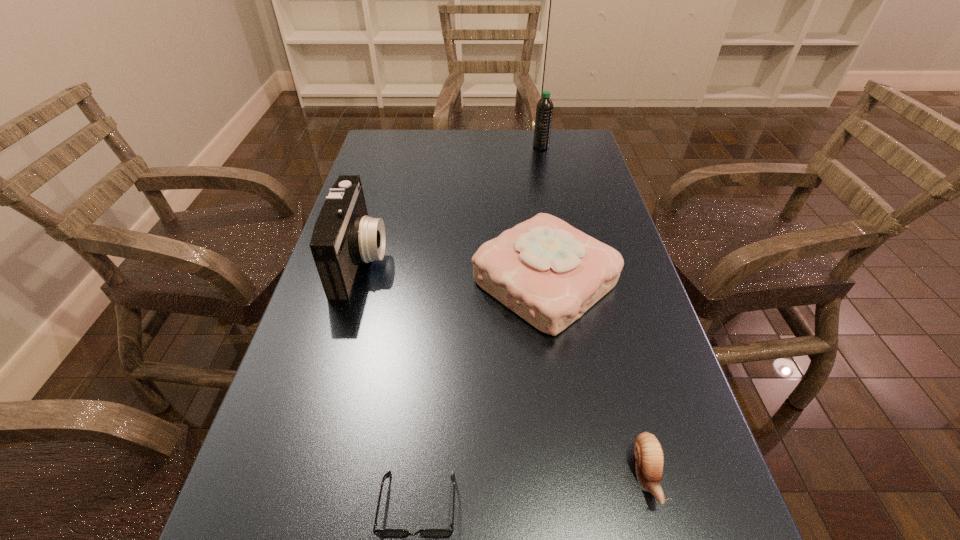
Locate an element on the screen. The height and width of the screenshot is (540, 960). the farthest object is located at coordinates (544, 110).

This screenshot has width=960, height=540. I want to click on camcorder, so click(343, 236).

Image resolution: width=960 pixels, height=540 pixels. I want to click on the third shortest object, so click(549, 273).

The width and height of the screenshot is (960, 540). Identify the location of the fourth tallest object. (649, 459).

This screenshot has width=960, height=540. What are the coordinates of `vacant space located on the left of the farthest object` in the screenshot? It's located at (494, 147).

I want to click on free point located on the lens of the camcorder, so click(410, 260).

Identify the location of vacant space located 0.050m on the right of the third shortest object. This screenshot has width=960, height=540. pyautogui.click(x=639, y=282).

You are a GUI agent. You are given a task and a screenshot of the screen. Output one action in this format:
    pyautogui.click(x=<x>, y=<y>)
    Task: Click on the object that is at the far edge
    The image size is (960, 540).
    Given the screenshot: What is the action you would take?
    pyautogui.click(x=544, y=110)

This screenshot has height=540, width=960. What are the coordinates of `object present at the left edge` in the screenshot? It's located at (343, 236).

Where is `water bottle that is at the right edge`? water bottle that is at the right edge is located at coordinates (544, 110).